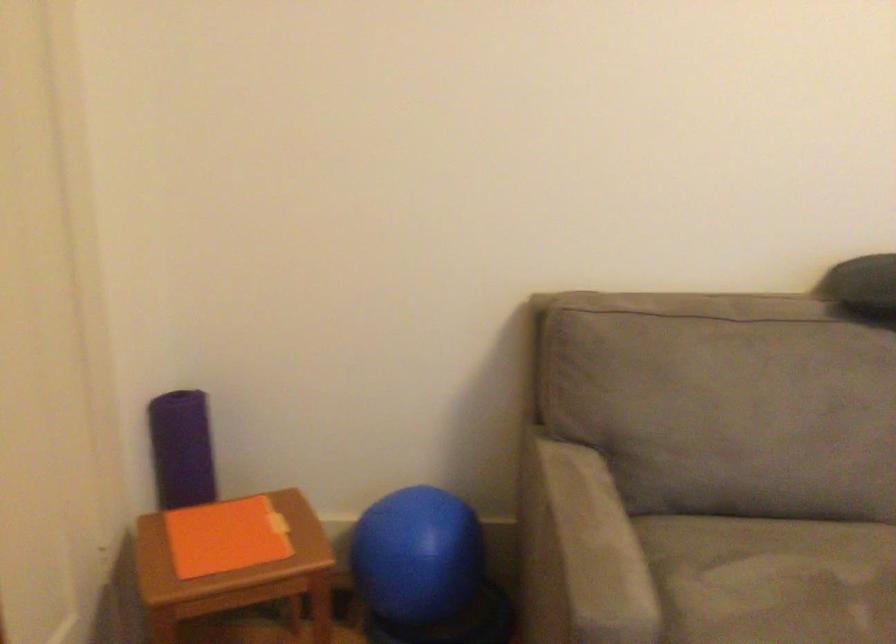
Where would you push the sofa armrest? Please return your answer as a coordinate pair (x, y).

(588, 550)